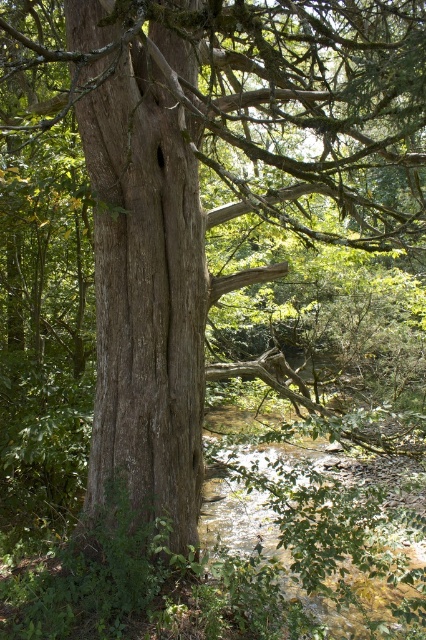
You are a hiker who wants to cross the clear water at lower center to reach the smooth brown tree trunk at center. The water is 1.2 meters deep. Your backpack has a rope that is 3 meters long. Can you use the rope to safely cross the water?

The distance between the smooth brown tree trunk at center and the clear water at lower center is 3.38 meters. Since the rope is only 3 meters long, it is 0.38 meters shorter than needed. Therefore, the rope is not long enough to safely cross the water.

You are standing in the forest looking at the large tree trunk. There are two points marked on the trunk, one at coordinates point (103, 336) and the other at point (226, 483). Which point is nearer to you?

Point (103, 336) is closer to the camera than point (226, 483), so the point at coordinates point (103, 336) is nearer to you.

You are standing in the forest and see the smooth brown tree trunk at center. If you want to take a photo of it, where should you position yourself relative to the center of the image to ensure the trunk is fully visible?

To ensure the smooth brown tree trunk at center is fully visible in your photo, position yourself at the center of the image since its 2D coordinates are at point (144, 292), which is near the center.